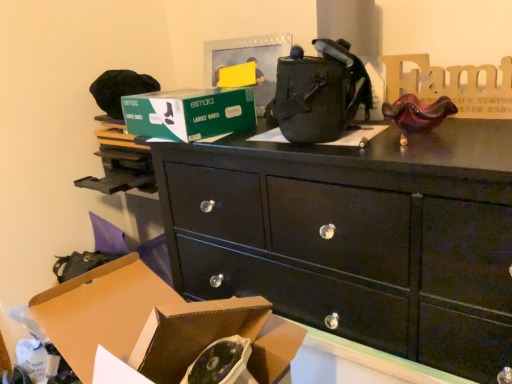
Find the location of a particular element. The height and width of the screenshot is (384, 512). brown cardboard box at lower left, the first box in the bottom-to-top sequence is located at coordinates (156, 324).

Where is `black glossy chest of drawers at center`? black glossy chest of drawers at center is located at coordinates (356, 237).

At what (x,y) coordinates should I click in order to perform the action: click on green cardboard box at upper center, placed as the 2th box when sorted from front to back. Please return your answer as a coordinate pair (x, y). Looking at the image, I should click on (189, 113).

From the image's perspective, is black glossy chest of drawers at center positioned above or below green cardboard box at upper center, which is the 1th box from top to bottom?

Based on their image positions, black glossy chest of drawers at center is located beneath green cardboard box at upper center, which is the 1th box from top to bottom.

Is black glossy chest of drawers at center in front of or behind green cardboard box at upper center, which is the 1th box from top to bottom, in the image?

Clearly, black glossy chest of drawers at center is in front of green cardboard box at upper center, which is the 1th box from top to bottom.

Is black glossy chest of drawers at center facing away from green cardboard box at upper center, arranged as the 1th box when viewed from the back?

No.

Is black glossy chest of drawers at center not close to green cardboard box at upper center, placed as the 2th box when sorted from front to back?

No, black glossy chest of drawers at center is not far from green cardboard box at upper center, placed as the 2th box when sorted from front to back.

Is green cardboard box at upper center, arranged as the 1th box when viewed from the back, oriented towards brown cardboard box at lower left, the first box in the bottom-to-top sequence?

No.

Can you confirm if green cardboard box at upper center, arranged as the 1th box when viewed from the back, is bigger than brown cardboard box at lower left, the first box from the front?

No, green cardboard box at upper center, arranged as the 1th box when viewed from the back, is not bigger than brown cardboard box at lower left, the first box from the front.

Which point is more forward, (163, 328) or (318, 268)?

The point (163, 328) is more forward.

Would you say brown cardboard box at lower left, which is the 2th box from top to bottom, is inside or outside black glossy chest of drawers at center?

brown cardboard box at lower left, which is the 2th box from top to bottom, cannot be found inside black glossy chest of drawers at center.

How many degrees apart are the facing directions of brown cardboard box at lower left, the first box in the bottom-to-top sequence, and black glossy chest of drawers at center?

The facing directions of brown cardboard box at lower left, the first box in the bottom-to-top sequence, and black glossy chest of drawers at center are 1.29 degrees apart.

Considering the sizes of brown cardboard box at lower left, the first box in the bottom-to-top sequence, and black glossy chest of drawers at center in the image, is brown cardboard box at lower left, the first box in the bottom-to-top sequence, wider or thinner than black glossy chest of drawers at center?

Clearly, brown cardboard box at lower left, the first box in the bottom-to-top sequence, has less width compared to black glossy chest of drawers at center.

Is point (270, 207) positioned in front of point (139, 331)?

No.

The image size is (512, 384). Find the location of `chest of drawers on the right of brown cardboard box at lower left, which is the 2th box from top to bottom`. chest of drawers on the right of brown cardboard box at lower left, which is the 2th box from top to bottom is located at coordinates (356, 237).

Can you see black glossy chest of drawers at center touching brown cardboard box at lower left, which is the 2th box from back to front?

No, black glossy chest of drawers at center is not touching brown cardboard box at lower left, which is the 2th box from back to front.

Is black glossy chest of drawers at center positioned with its back to brown cardboard box at lower left, the first box from the front?

Yes, brown cardboard box at lower left, the first box from the front, is at the back of black glossy chest of drawers at center.

Based on the photo, from the image's perspective, between green cardboard box at upper center, which is the 1th box from top to bottom, and black glossy chest of drawers at center, who is located below?

black glossy chest of drawers at center.

Is black glossy chest of drawers at center located within green cardboard box at upper center, arranged as the 1th box when viewed from the back?

Actually, black glossy chest of drawers at center is outside green cardboard box at upper center, arranged as the 1th box when viewed from the back.

From a real-world perspective, is green cardboard box at upper center, which is the 1th box from top to bottom, above or below black glossy chest of drawers at center?

From a real-world perspective, green cardboard box at upper center, which is the 1th box from top to bottom, is physically above black glossy chest of drawers at center.

Considering the positions of objects green cardboard box at upper center, placed as the 2th box when sorted from front to back, and black glossy chest of drawers at center in the image provided, who is in front, green cardboard box at upper center, placed as the 2th box when sorted from front to back, or black glossy chest of drawers at center?

black glossy chest of drawers at center is in front.

Consider the image. Who is taller, brown cardboard box at lower left, which is the 2th box from back to front, or green cardboard box at upper center, placed as the 2th box when sorted from front to back?

Standing taller between the two is brown cardboard box at lower left, which is the 2th box from back to front.

Is brown cardboard box at lower left, which is the 2th box from back to front, in front of or behind green cardboard box at upper center, placed as the 2th box when sorted from front to back, in the image?

brown cardboard box at lower left, which is the 2th box from back to front, is positioned closer to the viewer than green cardboard box at upper center, placed as the 2th box when sorted from front to back.

You are a GUI agent. You are given a task and a screenshot of the screen. Output one action in this format:
    pyautogui.click(x=<x>, y=<y>)
    Task: Click on the box on the right of green cardboard box at upper center, the second box when ordered from bottom to top
    This screenshot has height=384, width=512.
    Given the screenshot: What is the action you would take?
    pyautogui.click(x=156, y=324)

From the image's perspective, is brown cardboard box at lower left, the first box from the front, over green cardboard box at upper center, arranged as the 1th box when viewed from the back?

No, from the image's perspective, brown cardboard box at lower left, the first box from the front, is not above green cardboard box at upper center, arranged as the 1th box when viewed from the back.

This screenshot has width=512, height=384. Find the location of `box that is the 2nd object to the left of the black glossy chest of drawers at center, starting at the anchor`. box that is the 2nd object to the left of the black glossy chest of drawers at center, starting at the anchor is located at coordinates (189, 113).

There is a brown cardboard box at lower left, which is the 2th box from top to bottom. Find the location of `box above it (from a real-world perspective)`. box above it (from a real-world perspective) is located at coordinates (189, 113).

From the image, which object appears to be nearer to green cardboard box at upper center, which is the 1th box from top to bottom, black glossy chest of drawers at center or brown cardboard box at lower left, which is the 2th box from top to bottom?

Based on the image, black glossy chest of drawers at center appears to be nearer to green cardboard box at upper center, which is the 1th box from top to bottom.

From the image, which object appears to be nearer to black glossy chest of drawers at center, green cardboard box at upper center, the second box when ordered from bottom to top, or brown cardboard box at lower left, which is the 2th box from back to front?

green cardboard box at upper center, the second box when ordered from bottom to top.

Estimate the real-world distances between objects in this image. Which object is further from green cardboard box at upper center, which is the 1th box from top to bottom, brown cardboard box at lower left, the first box in the bottom-to-top sequence, or black glossy chest of drawers at center?

brown cardboard box at lower left, the first box in the bottom-to-top sequence, lies further to green cardboard box at upper center, which is the 1th box from top to bottom, than the other object.

When comparing their distances from brown cardboard box at lower left, which is the 2th box from back to front, does green cardboard box at upper center, arranged as the 1th box when viewed from the back, or black glossy chest of drawers at center seem closer?

black glossy chest of drawers at center lies closer to brown cardboard box at lower left, which is the 2th box from back to front, than the other object.

When comparing their distances from black glossy chest of drawers at center, does brown cardboard box at lower left, which is the 2th box from back to front, or green cardboard box at upper center, which is the 1th box from top to bottom, seem further?

Based on the image, brown cardboard box at lower left, which is the 2th box from back to front, appears to be further to black glossy chest of drawers at center.

When comparing their distances from brown cardboard box at lower left, which is the 2th box from top to bottom, does black glossy chest of drawers at center or green cardboard box at upper center, arranged as the 1th box when viewed from the back, seem further?

green cardboard box at upper center, arranged as the 1th box when viewed from the back, lies further to brown cardboard box at lower left, which is the 2th box from top to bottom, than the other object.

I want to click on chest of drawers between green cardboard box at upper center, arranged as the 1th box when viewed from the back, and brown cardboard box at lower left, which is the 2th box from back to front, from top to bottom, so click(x=356, y=237).